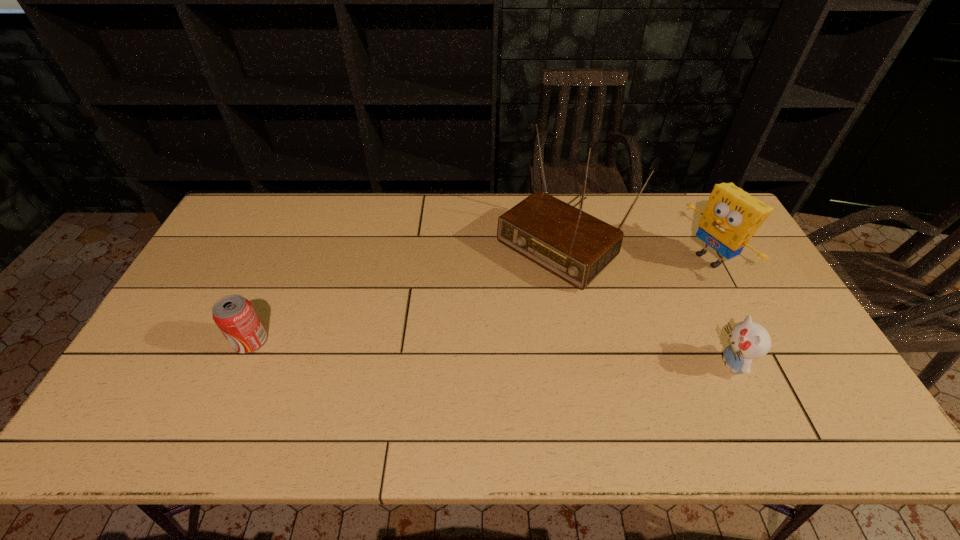
Find the location of a particular element. The width and height of the screenshot is (960, 540). free space that is in between the kitten and the radio_receiver is located at coordinates (645, 301).

Find the location of a particular element. The height and width of the screenshot is (540, 960). empty space between the tallest object and the leftmost object is located at coordinates click(x=404, y=290).

This screenshot has width=960, height=540. Identify the location of free point between the tallest object and the soda can. (404, 290).

Find the location of a particular element. This screenshot has width=960, height=540. vacant space that's between the tallest object and the kitten is located at coordinates (645, 301).

Find the location of a particular element. This screenshot has height=540, width=960. vacant space in between the radio_receiver and the soda can is located at coordinates (404, 290).

Image resolution: width=960 pixels, height=540 pixels. I want to click on free space between the tallest object and the soda can, so click(404, 290).

Locate an element on the screen. free area in between the third shortest object and the kitten is located at coordinates (721, 311).

Where is `the second closest object to the second tallest object`? the second closest object to the second tallest object is located at coordinates (748, 340).

Point out which object is positioned as the third nearest to the second tallest object. Please provide its 2D coordinates. Your answer should be formatted as a tuple, i.e. [(x, y)], where the tuple contains the x and y coordinates of a point satisfying the conditions above.

[(234, 315)]

This screenshot has width=960, height=540. I want to click on free space in the image that satisfies the following two spatial constraints: 1. on the front side of the soda can; 2. on the front-facing side of the kitten, so click(241, 363).